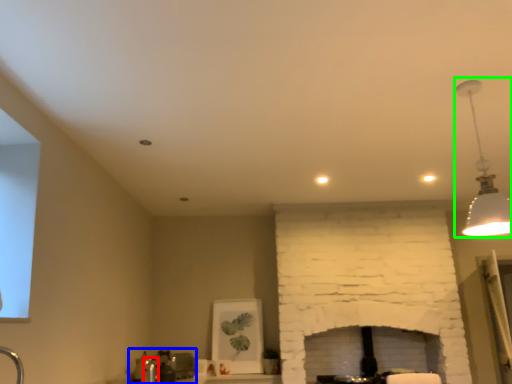
Question: Based on their relative distances, which object is farther from faucet (highlighted by a red box)? Choose from sink (highlighted by a blue box) and lamp (highlighted by a green box).

Choices:
 (A) sink
 (B) lamp

Answer: (B)